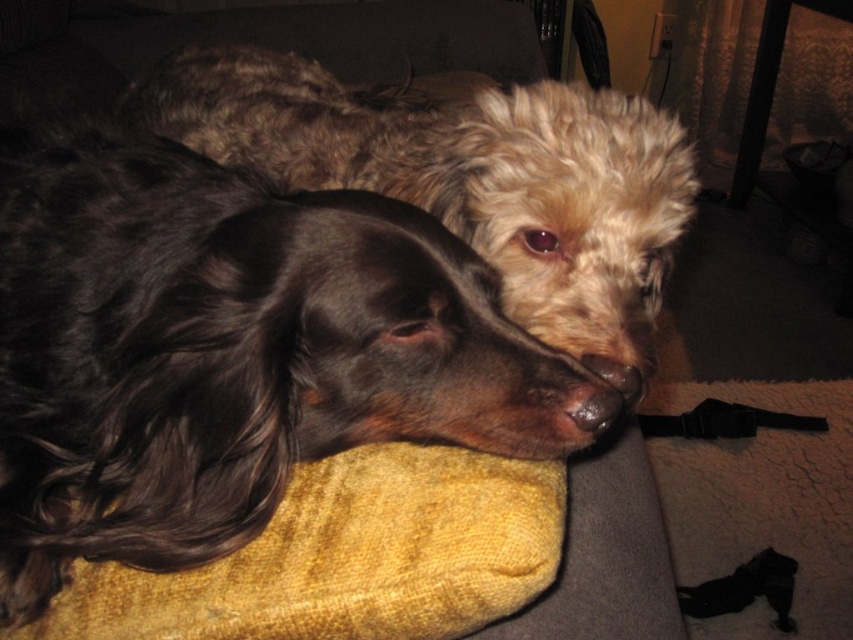
Is black smooth nose at lower center below brown matte nose at center?

Correct, black smooth nose at lower center is located below brown matte nose at center.

In the scene shown: Is the position of black smooth nose at lower center less distant than that of brown matte nose at center?

Yes.

Where is `black smooth nose at lower center`? The image size is (853, 640). black smooth nose at lower center is located at coordinates (595, 406).

Is shiny black coat at center positioned at the back of black smooth nose at lower center?

No, shiny black coat at center is in front of black smooth nose at lower center.

Is shiny black coat at center taller than black smooth nose at lower center?

Indeed, shiny black coat at center has a greater height compared to black smooth nose at lower center.

This screenshot has height=640, width=853. What are the coordinates of `shiny black coat at center` in the screenshot? It's located at (224, 352).

Locate an element on the screen. shiny black coat at center is located at coordinates (224, 352).

Does shiny brown fur at center have a smaller size compared to brown matte nose at center?

Incorrect, shiny brown fur at center is not smaller in size than brown matte nose at center.

Which is behind, point (587, 282) or point (625, 372)?

Point (587, 282)

Is point (384, 188) more distant than point (636, 394)?

Yes, point (384, 188) is behind point (636, 394).

This screenshot has height=640, width=853. In order to click on shiny brown fur at center in this screenshot , I will do `click(467, 177)`.